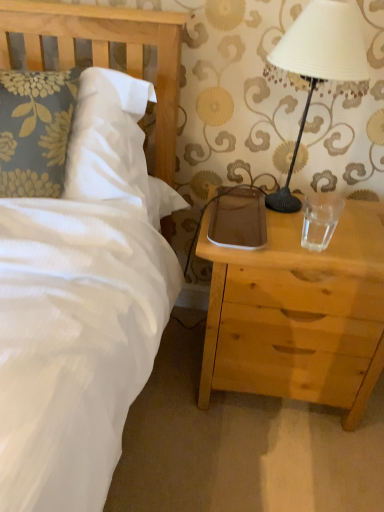
Question: Is brown leather pad at right not near transparent glass at right?

Choices:
 (A) yes
 (B) no

Answer: (B)

Question: Can you confirm if brown leather pad at right is smaller than transparent glass at right?

Choices:
 (A) yes
 (B) no

Answer: (B)

Question: Is brown leather pad at right located outside transparent glass at right?

Choices:
 (A) no
 (B) yes

Answer: (B)

Question: Does brown leather pad at right lie behind transparent glass at right?

Choices:
 (A) no
 (B) yes

Answer: (B)

Question: Is brown leather pad at right to the left of transparent glass at right from the viewer's perspective?

Choices:
 (A) no
 (B) yes

Answer: (B)

Question: Considering the positions of point pyautogui.click(x=251, y=204) and point pyautogui.click(x=266, y=197), is point pyautogui.click(x=251, y=204) closer or farther from the camera than point pyautogui.click(x=266, y=197)?

Choices:
 (A) closer
 (B) farther

Answer: (A)

Question: Is brown leather pad at right wider or thinner than white matte lampshade at upper right?

Choices:
 (A) wide
 (B) thin

Answer: (A)

Question: From a real-world perspective, is brown leather pad at right above or below white matte lampshade at upper right?

Choices:
 (A) below
 (B) above

Answer: (A)

Question: In terms of size, does brown leather pad at right appear bigger or smaller than white matte lampshade at upper right?

Choices:
 (A) big
 (B) small

Answer: (B)

Question: Based on their positions, is transparent glass at right located to the left or right of wooden headboard at upper left?

Choices:
 (A) right
 (B) left

Answer: (A)

Question: From the image's perspective, is transparent glass at right positioned above or below wooden headboard at upper left?

Choices:
 (A) above
 (B) below

Answer: (B)

Question: From their relative heights in the image, would you say transparent glass at right is taller or shorter than wooden headboard at upper left?

Choices:
 (A) short
 (B) tall

Answer: (A)

Question: Is transparent glass at right in front of or behind wooden headboard at upper left in the image?

Choices:
 (A) front
 (B) behind

Answer: (B)

Question: In terms of height, does wooden headboard at upper left look taller or shorter compared to transparent glass at right?

Choices:
 (A) short
 (B) tall

Answer: (B)

Question: Looking at the image, does wooden headboard at upper left seem bigger or smaller compared to transparent glass at right?

Choices:
 (A) small
 (B) big

Answer: (B)